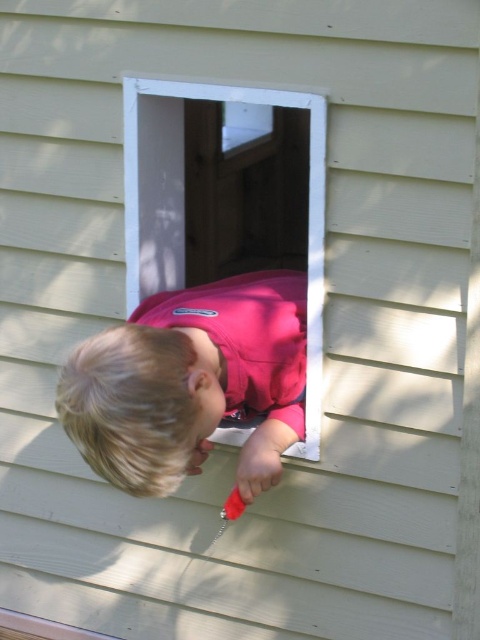
Is point (146, 428) less distant than point (301, 456)?

Yes, point (146, 428) is closer to viewer.

Is pink matte shirt at center positioned before white plastic window at center?

Yes, pink matte shirt at center is in front of white plastic window at center.

Find the location of a particular element. pink matte shirt at center is located at coordinates (191, 381).

At what (x,y) coordinates should I click in order to perform the action: click on pink matte shirt at center. Please return your answer as a coordinate pair (x, y). The image size is (480, 640). Looking at the image, I should click on (191, 381).